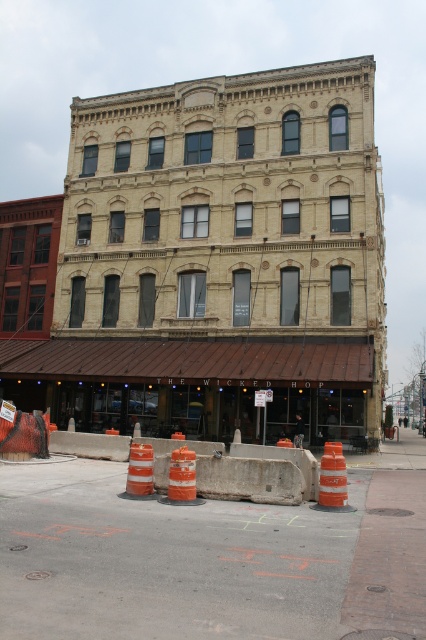
Does concrete at center have a greater width compared to orange reflective cone at center?

Indeed, concrete at center has a greater width compared to orange reflective cone at center.

Can you confirm if concrete at center is thinner than orange reflective cone at center?

Incorrect, concrete at center's width is not less than orange reflective cone at center's.

Describe the element at coordinates (256, 474) in the screenshot. This screenshot has width=426, height=640. I see `concrete at center` at that location.

Image resolution: width=426 pixels, height=640 pixels. In order to click on concrete at center in this screenshot , I will do `click(256, 474)`.

Is orange traffic cones at center below orange reflective cone at center?

Yes.

Does point (55, 538) lie behind point (149, 454)?

That is False.

You are a GUI agent. You are given a task and a screenshot of the screen. Output one action in this format:
    pyautogui.click(x=<x>, y=<y>)
    Task: Click on the orange traffic cones at center
    Image resolution: width=426 pixels, height=640 pixels.
    Given the screenshot: What is the action you would take?
    pyautogui.click(x=212, y=557)

Is point (169, 621) closer to camera compared to point (270, 499)?

Yes, it is.

Consider the image. Does orange traffic cones at center come in front of concrete at center?

That is True.

Is point (367, 490) closer to viewer compared to point (221, 464)?

That is False.

This screenshot has height=640, width=426. Identify the location of orange traffic cones at center. click(x=212, y=557).